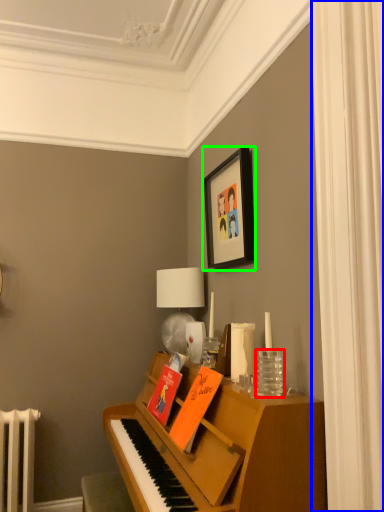
Question: Which object is positioned closest to glass vase (highlighted by a red box)? Select from curtain (highlighted by a blue box) and picture frame (highlighted by a green box).

Choices:
 (A) curtain
 (B) picture frame

Answer: (A)